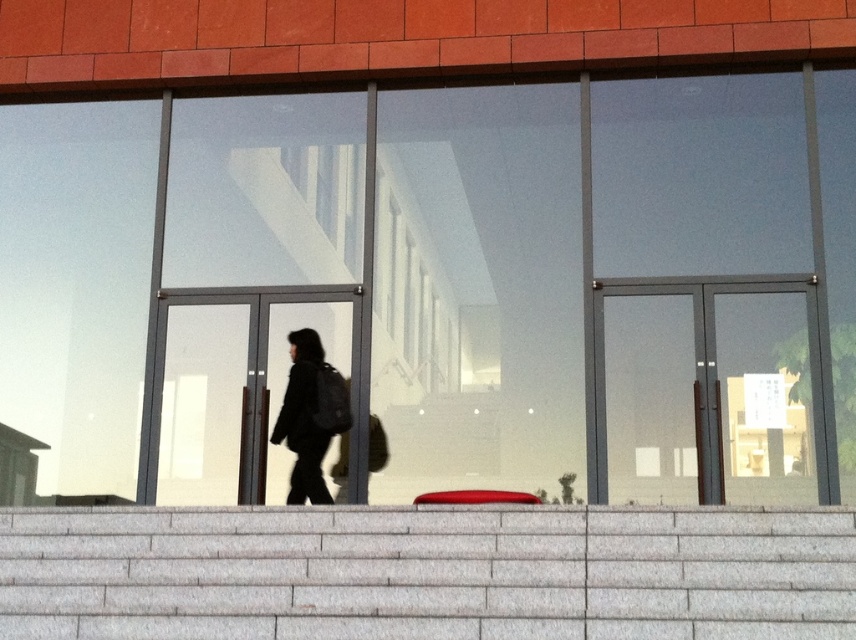
Question: Is transparent glass window at center behind gray stone stairs at lower center?

Choices:
 (A) yes
 (B) no

Answer: (A)

Question: Which of the following is the farthest from the observer?

Choices:
 (A) (746, 232)
 (B) (302, 477)
 (C) (369, 518)

Answer: (A)

Question: Can you confirm if transparent glass window at center is positioned below gray stone stairs at lower center?

Choices:
 (A) no
 (B) yes

Answer: (A)

Question: Which of these objects is positioned closest to the gray stone stairs at lower center?

Choices:
 (A) transparent glass window at center
 (B) black matte backpack at center

Answer: (B)

Question: Which point is farther to the camera?

Choices:
 (A) click(x=631, y=584)
 (B) click(x=318, y=424)
 (C) click(x=586, y=122)

Answer: (C)

Question: Considering the relative positions of transparent glass window at center and black matte backpack at center in the image provided, where is transparent glass window at center located with respect to black matte backpack at center?

Choices:
 (A) right
 (B) left

Answer: (B)